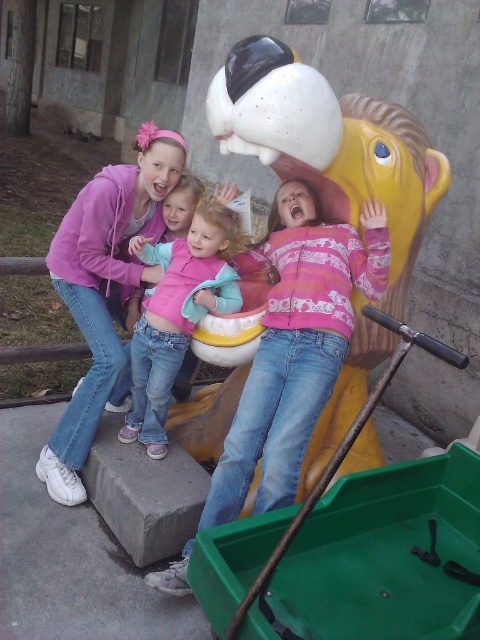
Is pink fleece jacket at center bigger than pink fleece jacket at upper center?

Yes, pink fleece jacket at center is bigger than pink fleece jacket at upper center.

Can you confirm if pink fleece jacket at center is positioned to the right of pink fleece jacket at upper center?

Yes, pink fleece jacket at center is to the right of pink fleece jacket at upper center.

Image resolution: width=480 pixels, height=640 pixels. What do you see at coordinates (296, 346) in the screenshot? I see `pink fleece jacket at center` at bounding box center [296, 346].

Identify the location of pink fleece jacket at center. (296, 346).

The height and width of the screenshot is (640, 480). In order to click on matte pink hoodie at center in this screenshot , I will do `click(105, 291)`.

Who is shorter, matte pink hoodie at center or pink fleece jacket at upper center?

pink fleece jacket at upper center is shorter.

Where is `matte pink hoodie at center`? matte pink hoodie at center is located at coordinates (105, 291).

This screenshot has width=480, height=640. I want to click on matte pink hoodie at center, so click(105, 291).

Is pink fleece jacket at center to the right of matte pink hoodie at center from the viewer's perspective?

Yes, pink fleece jacket at center is to the right of matte pink hoodie at center.

Can you confirm if pink fleece jacket at center is positioned to the left of matte pink hoodie at center?

In fact, pink fleece jacket at center is to the right of matte pink hoodie at center.

This screenshot has width=480, height=640. Find the location of `pink fleece jacket at center`. pink fleece jacket at center is located at coordinates (296, 346).